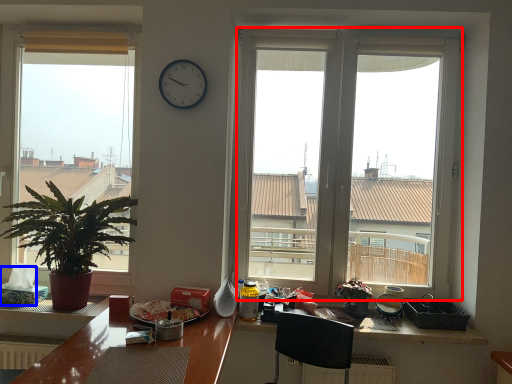
Question: Which point is further to the camera, window (highlighted by a red box) or tissue paper (highlighted by a blue box)?

Choices:
 (A) window
 (B) tissue paper

Answer: (A)